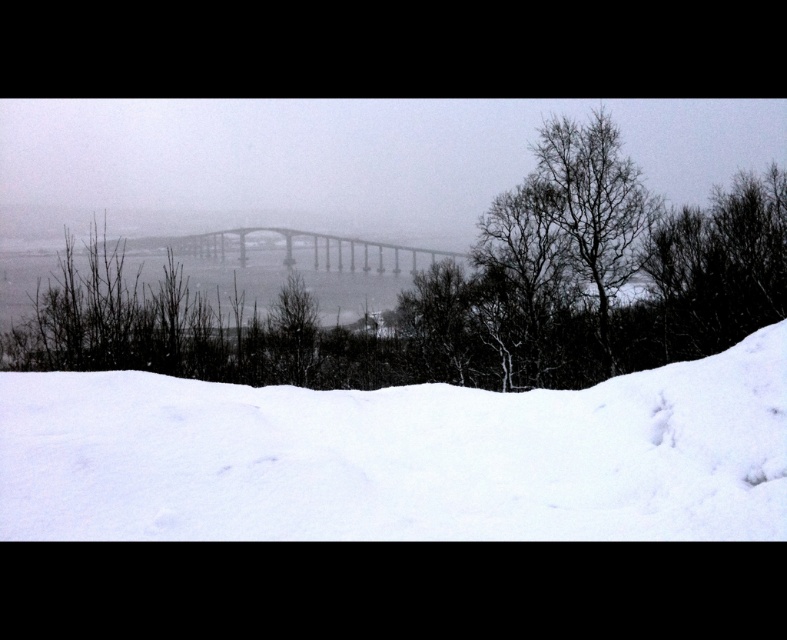
Consider the image. Can you confirm if white snow at lower center is positioned to the left of gray metallic bridge at center?

In fact, white snow at lower center is to the right of gray metallic bridge at center.

Can you confirm if white snow at lower center is shorter than gray metallic bridge at center?

Yes.

Who is more distant from viewer, (737, 426) or (187, 253)?

Point (187, 253)

Find the location of a particular element. The image size is (787, 640). white snow at lower center is located at coordinates (401, 458).